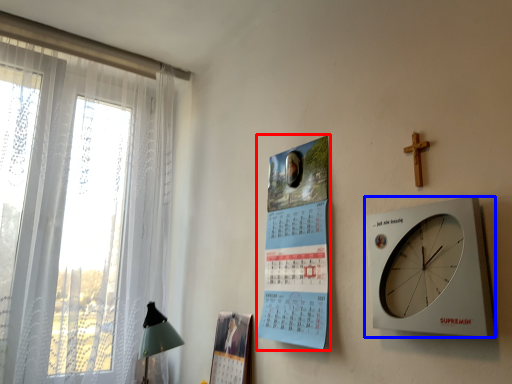
Question: Which object appears farthest to the camera in this image, poster page (highlighted by a red box) or wall clock (highlighted by a blue box)?

Choices:
 (A) poster page
 (B) wall clock

Answer: (A)